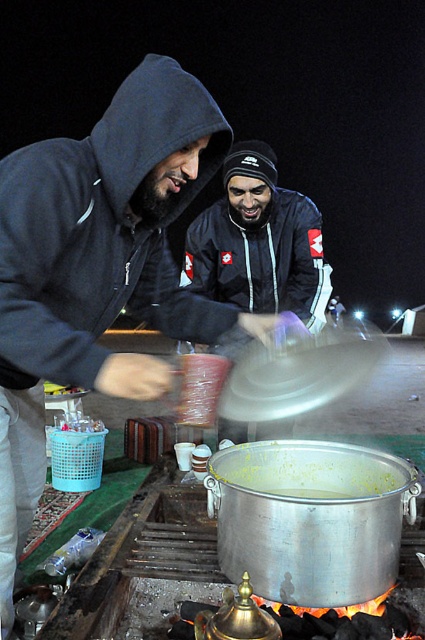
Can you confirm if matte black hoodie at center is positioned below black matte jacket at center?

Yes.

Between point (99, 296) and point (260, 301), which one is positioned in front?

Point (99, 296) is in front.

What are the coordinates of `matte black hoodie at center` in the screenshot? It's located at (98, 268).